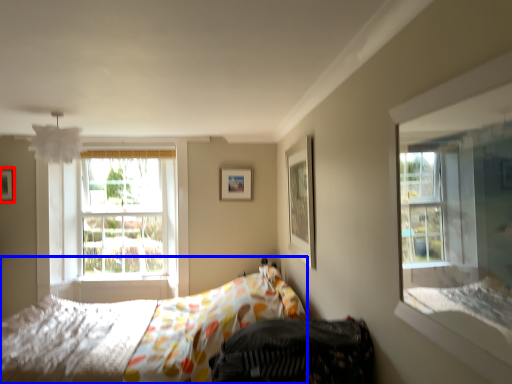
Question: Which object is closer to the camera taking this photo, picture frame (highlighted by a red box) or bed (highlighted by a blue box)?

Choices:
 (A) picture frame
 (B) bed

Answer: (B)